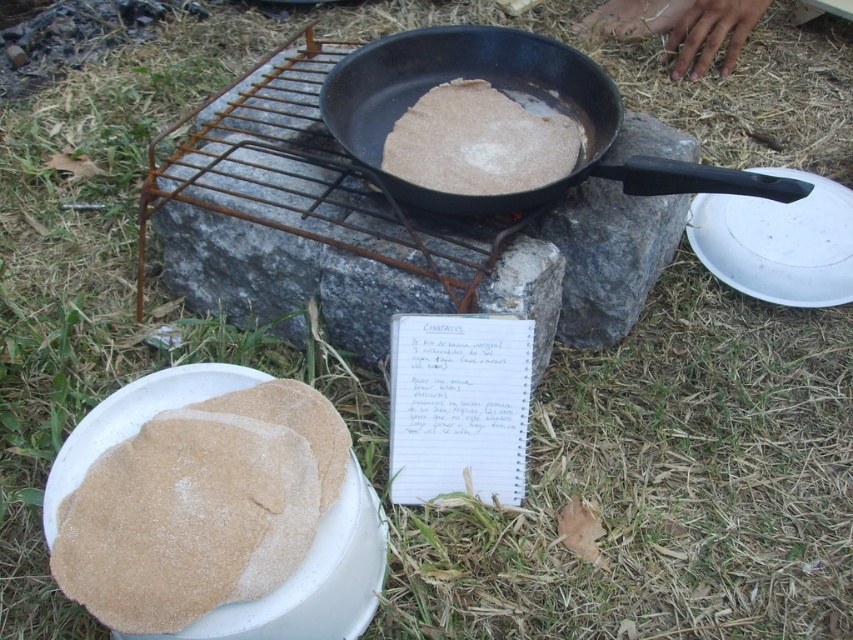
Question: Does brown matte flatbread at lower left appear on the right side of brown matte flatbread at center?

Choices:
 (A) no
 (B) yes

Answer: (A)

Question: Estimate the real-world distances between objects in this image. Which object is closer to the brown matte flatbread at lower left?

Choices:
 (A) brown matte flatbread at center
 (B) black non-stick frying pan at center

Answer: (B)

Question: Which of these objects is positioned closest to the brown matte flatbread at center?

Choices:
 (A) black non-stick frying pan at center
 (B) brown matte flatbread at lower left

Answer: (A)

Question: Which point is closer to the camera?

Choices:
 (A) black non-stick frying pan at center
 (B) brown matte flatbread at lower left

Answer: (B)

Question: Is black non-stick frying pan at center bigger than brown matte flatbread at center?

Choices:
 (A) yes
 (B) no

Answer: (A)

Question: Observing the image, what is the correct spatial positioning of black non-stick frying pan at center in reference to brown matte flatbread at center?

Choices:
 (A) below
 (B) above

Answer: (A)